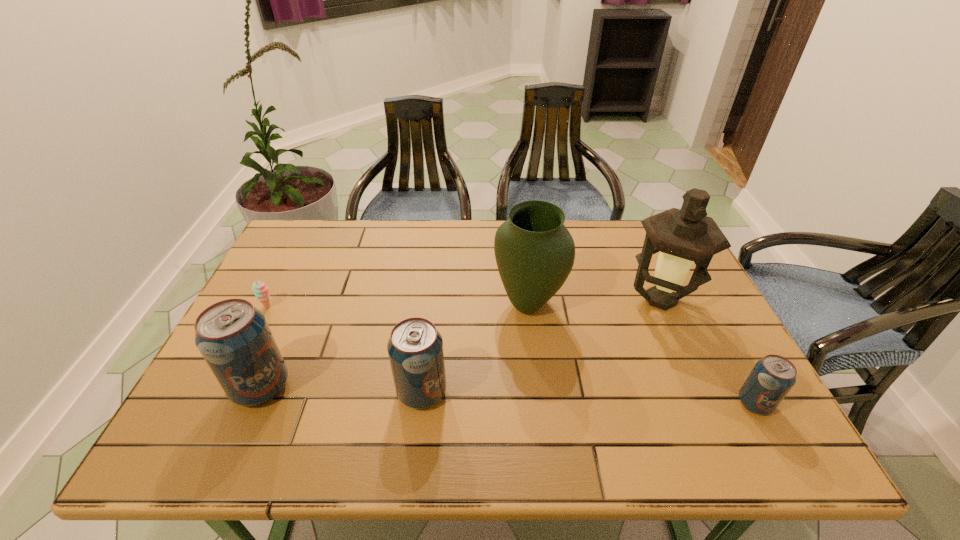
Please point a location where one more pop_(soda) can be added evenly. Please provide its 2D coordinates. Your answer should be formatted as a tuple, i.e. [(x, y)], where the tuple contains the x and y coordinates of a point satisfying the conditions above.

[(587, 397)]